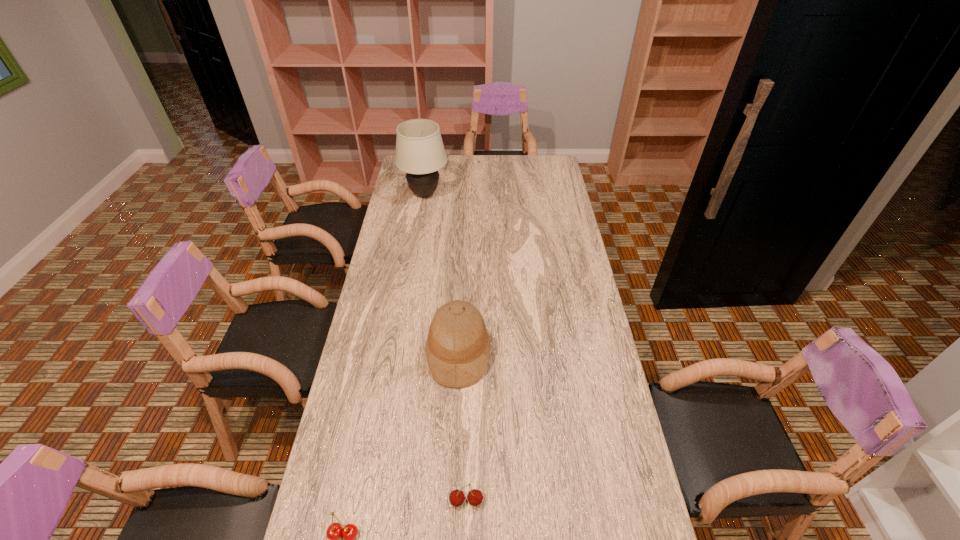
Locate an element on the screen. object that is the closest one to the second nearest object is located at coordinates (349, 532).